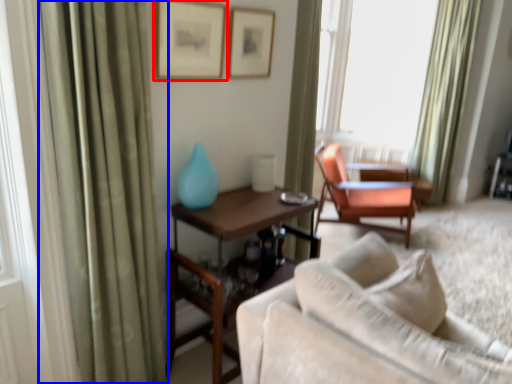
Question: Among these objects, which one is farthest to the camera, picture frame (highlighted by a red box) or curtain (highlighted by a blue box)?

Choices:
 (A) picture frame
 (B) curtain

Answer: (A)